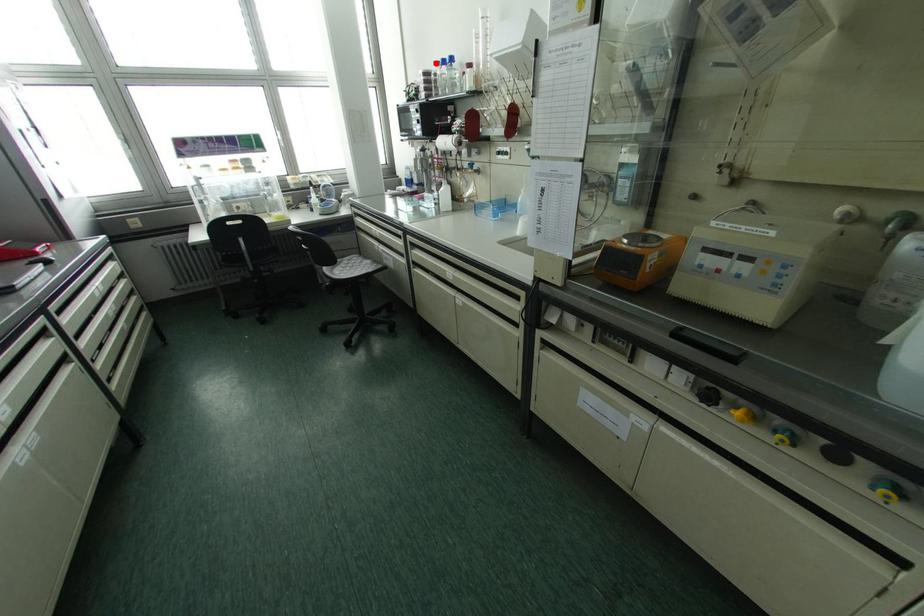
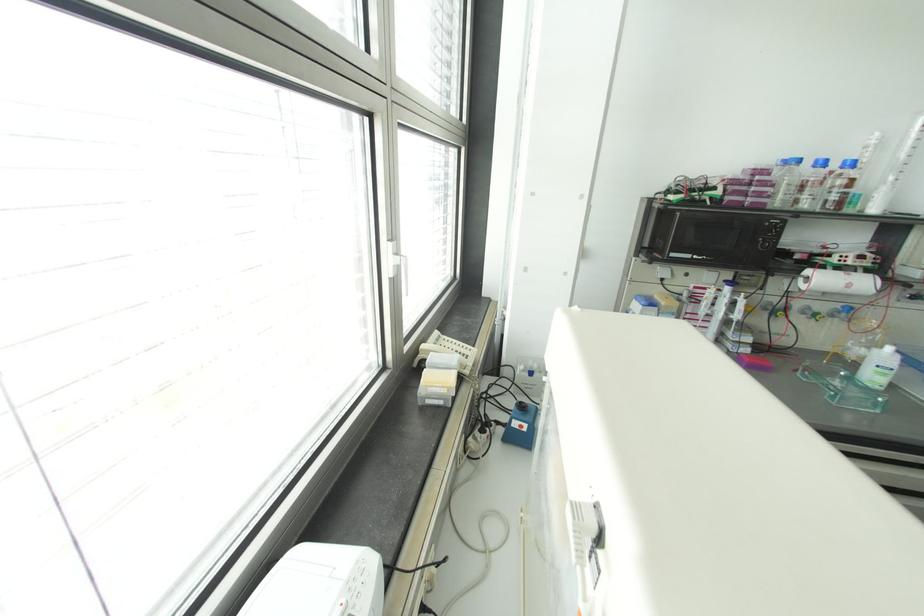
Question: I am providing you with two images of the same scene from different viewpoints. Given a red point in image1, look at the same physical point in image2. Is it:

Choices:
 (A) Closer to the viewpoint
 (B) Farther from the viewpoint

Answer: (B)